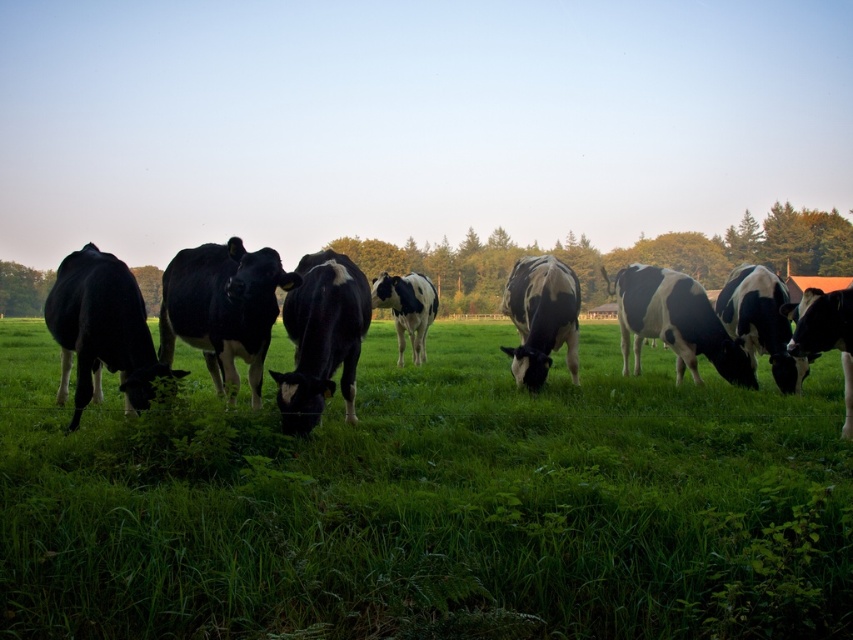
Question: Does green grassy at center appear under black and white cow at left?

Choices:
 (A) yes
 (B) no

Answer: (A)

Question: Which of the following is the closest to the observer?

Choices:
 (A) black and white spotted cow at center
 (B) green grassy at center

Answer: (B)

Question: Which point is closer to the camera taking this photo?

Choices:
 (A) (724, 541)
 (B) (401, 340)

Answer: (A)

Question: Does black and white cow at left have a larger size compared to black and white spotted cow at center?

Choices:
 (A) no
 (B) yes

Answer: (A)

Question: Which object is positioned farthest from the black and white cow at left?

Choices:
 (A) green grassy at center
 (B) black and white spotted cow at center

Answer: (B)

Question: Observing the image, what is the correct spatial positioning of green grassy at center in reference to black and white cow at left?

Choices:
 (A) left
 (B) right

Answer: (A)